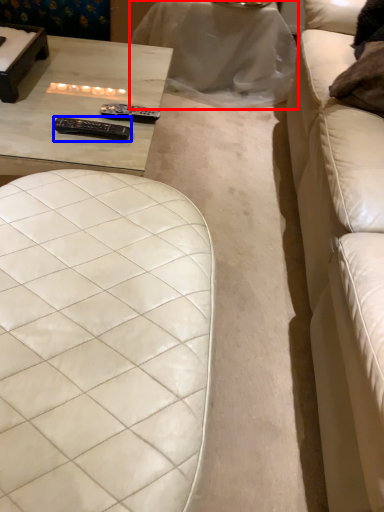
Question: Which point is closer to the camera, table (highlighted by a red box) or remote (highlighted by a blue box)?

Choices:
 (A) table
 (B) remote

Answer: (B)